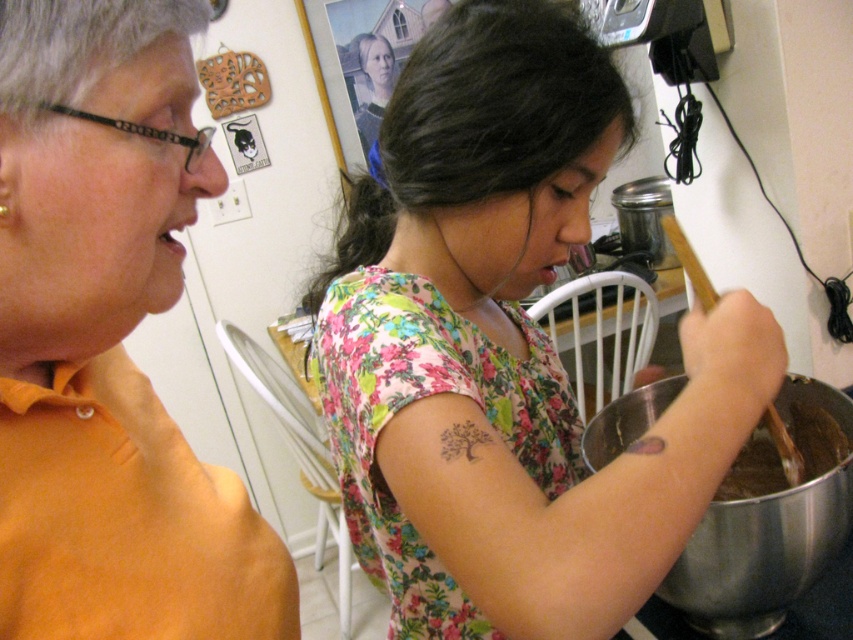
Question: Is floral fabric shirt at center above metallic silver mixing bowl at lower right?

Choices:
 (A) no
 (B) yes

Answer: (B)

Question: Can you confirm if floral fabric shirt at center is bigger than orange matte shirt at left?

Choices:
 (A) no
 (B) yes

Answer: (B)

Question: Is floral fabric shirt at center in front of orange matte shirt at left?

Choices:
 (A) no
 (B) yes

Answer: (A)

Question: Estimate the real-world distances between objects in this image. Which object is closer to the floral fabric shirt at center?

Choices:
 (A) orange matte shirt at left
 (B) metallic silver mixing bowl at lower right

Answer: (B)

Question: Which object is closer to the camera taking this photo?

Choices:
 (A) floral fabric shirt at center
 (B) metallic silver mixing bowl at lower right

Answer: (A)

Question: Which of these objects is positioned farthest from the metallic silver mixing bowl at lower right?

Choices:
 (A) floral fabric shirt at center
 (B) orange matte shirt at left

Answer: (B)